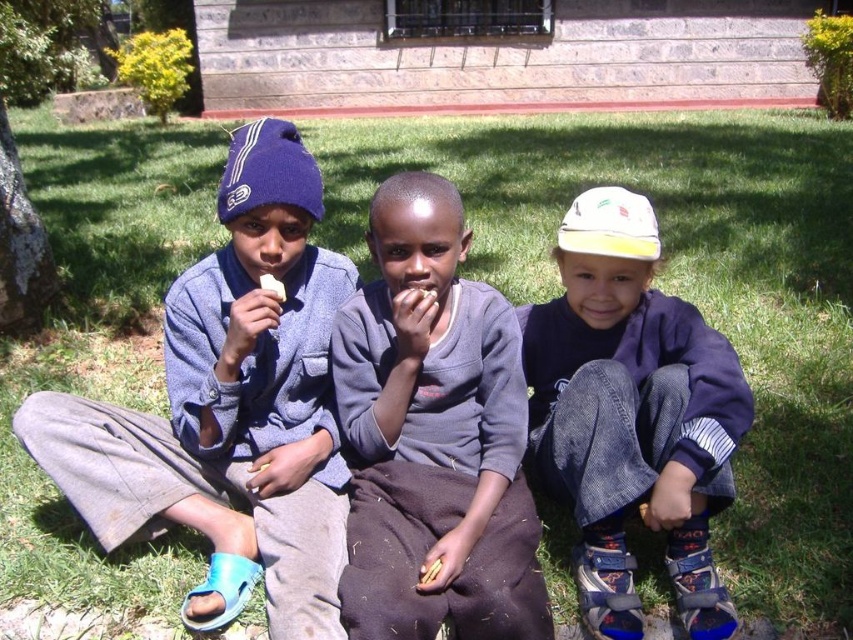
Question: Which point is farther to the camera?

Choices:
 (A) yellow wooden sticks at center
 (B) matte blue knit cap at upper left
 (C) blue knit beanie at left

Answer: (B)

Question: Which object is positioned farthest from the gray cotton sweater at center?

Choices:
 (A) yellow wooden sticks at center
 (B) white creamy bread at center
 (C) white cotton baseball cap at center
 (D) white cotton cap at center

Answer: (C)

Question: Does white cotton cap at center have a smaller size compared to white cotton baseball cap at center?

Choices:
 (A) no
 (B) yes

Answer: (A)

Question: In this image, where is white cotton cap at center located relative to white cotton baseball cap at center?

Choices:
 (A) above
 (B) below

Answer: (B)

Question: Is the position of blue knit beanie at left more distant than that of matte blue knit cap at upper left?

Choices:
 (A) no
 (B) yes

Answer: (A)

Question: Which of the following is the closest to the observer?

Choices:
 (A) yellow wooden sticks at center
 (B) matte blue knit cap at upper left

Answer: (A)